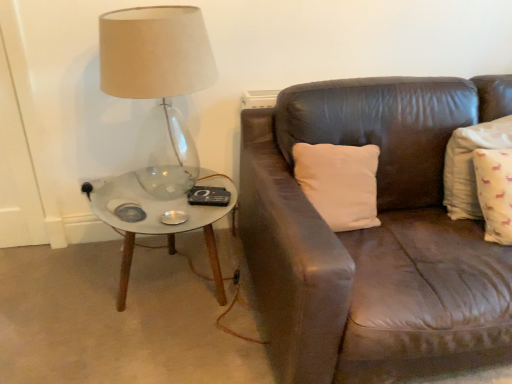
Question: Considering the positions of translucent glass lamp at left and white marble coffee table at left in the image, is translucent glass lamp at left bigger or smaller than white marble coffee table at left?

Choices:
 (A) small
 (B) big

Answer: (B)

Question: Is translucent glass lamp at left taller or shorter than white marble coffee table at left?

Choices:
 (A) short
 (B) tall

Answer: (B)

Question: Which object is the farthest from the white cotton pillow at right?

Choices:
 (A) translucent glass lamp at left
 (B) white marble coffee table at left

Answer: (A)

Question: Which is farther from the white cotton pillow at right?

Choices:
 (A) translucent glass lamp at left
 (B) white marble coffee table at left

Answer: (A)